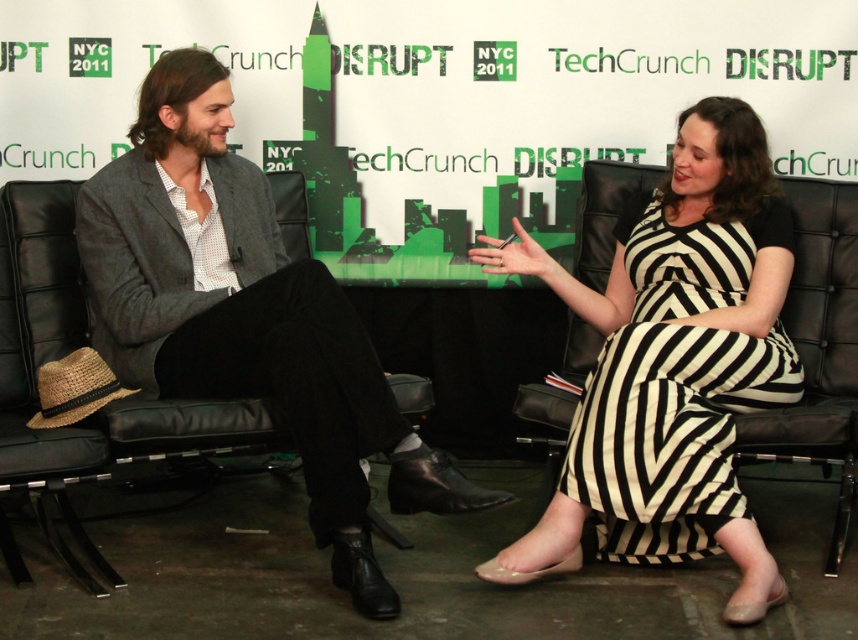
You are a photographer setting up for a group photo at the TechCrunch Disrupt NYC 2011 event. You need to position two subjects wearing the matte gray blazer at center and the black and white striped dress at center so that there is exactly 3 feet of space between them. Based on their current positions, is the existing distance sufficient? Please explain your reasoning.

The current distance between the matte gray blazer at center and the black and white striped dress at center is 36.99 inches. Since 3 feet equals 36 inches, the existing distance is slightly more than required. Therefore, the subjects should move about 0.99 inches closer to achieve the exact 3 feet requirement.

In the scene described, there are two people sitting on black leather chairs. The person on the left is wearing a matte gray blazer at center, and the person on the right is wearing a black and white striped dress at center. Which clothing item is positioned to the left of the other?

The matte gray blazer at center is to the left of the black and white striped dress at center.